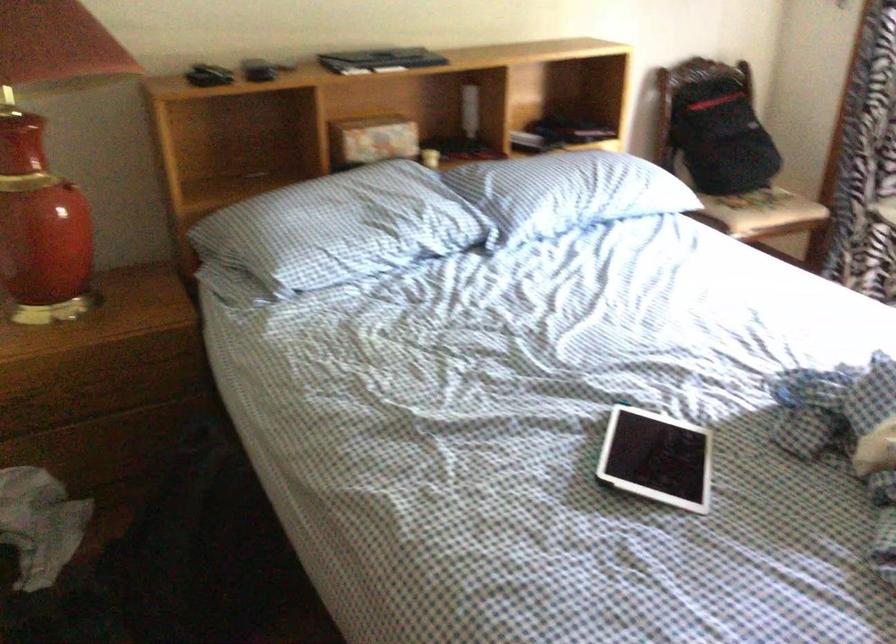
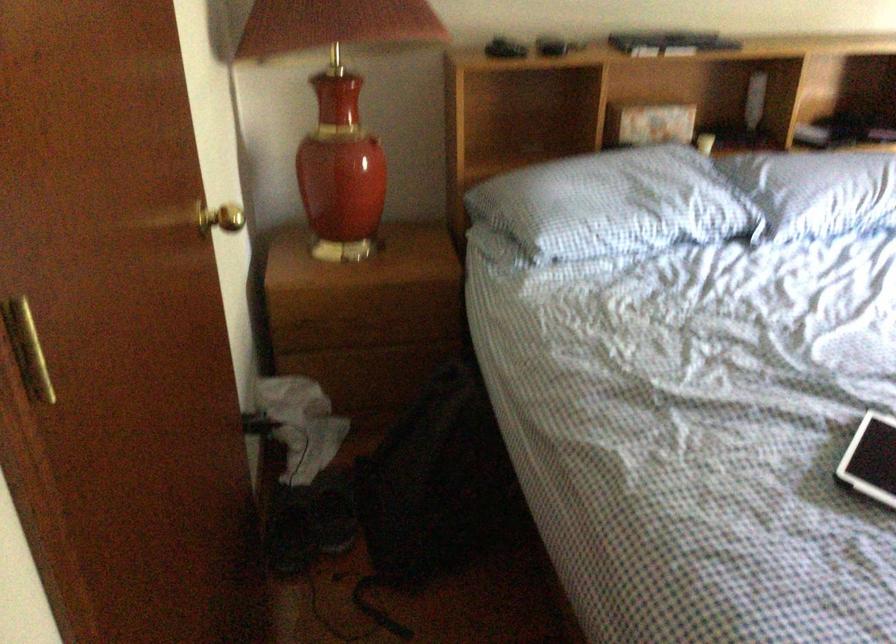
The point at (537,199) is marked in the first image. Where is the corresponding point in the second image?

(817, 191)